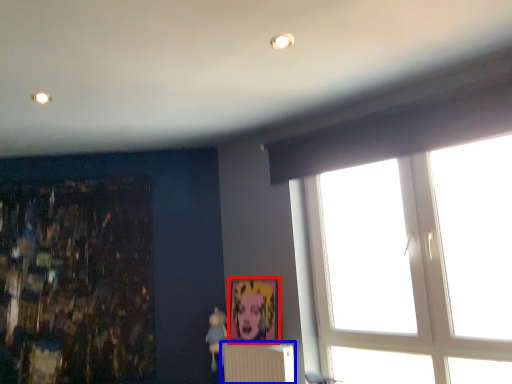
Question: Which of the following is the farthest to the observer, picture frame (highlighted by a red box) or radiator (highlighted by a blue box)?

Choices:
 (A) picture frame
 (B) radiator

Answer: (A)